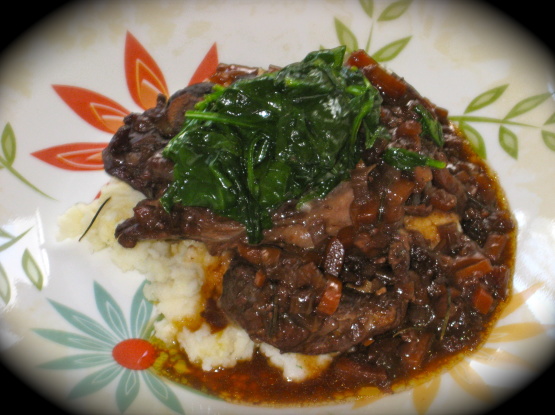
Image resolution: width=555 pixels, height=415 pixels. Find the location of `curved edge of plate`. curved edge of plate is located at coordinates (511, 382), (26, 372).